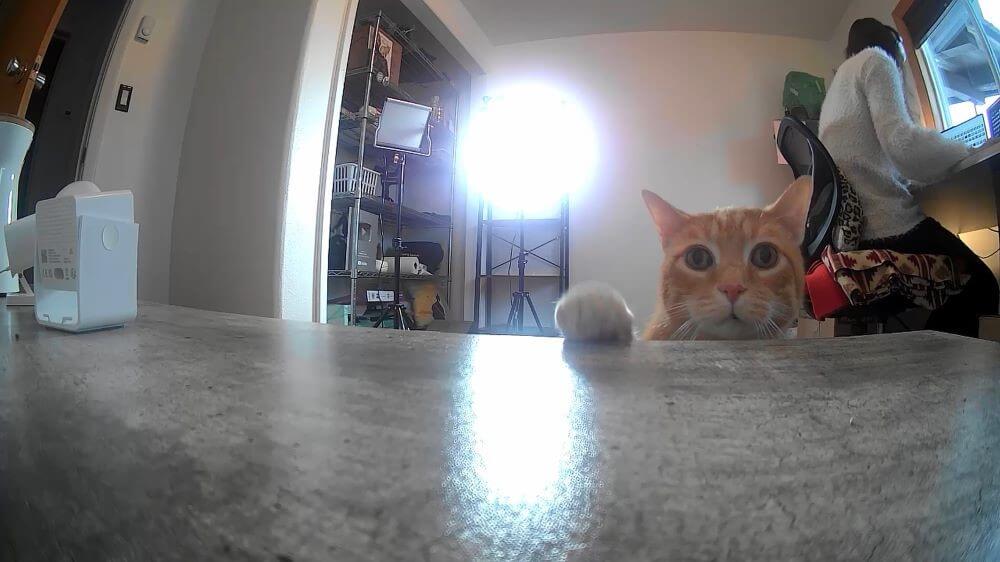
I want to click on shelves, so click(x=480, y=262), click(x=365, y=121).